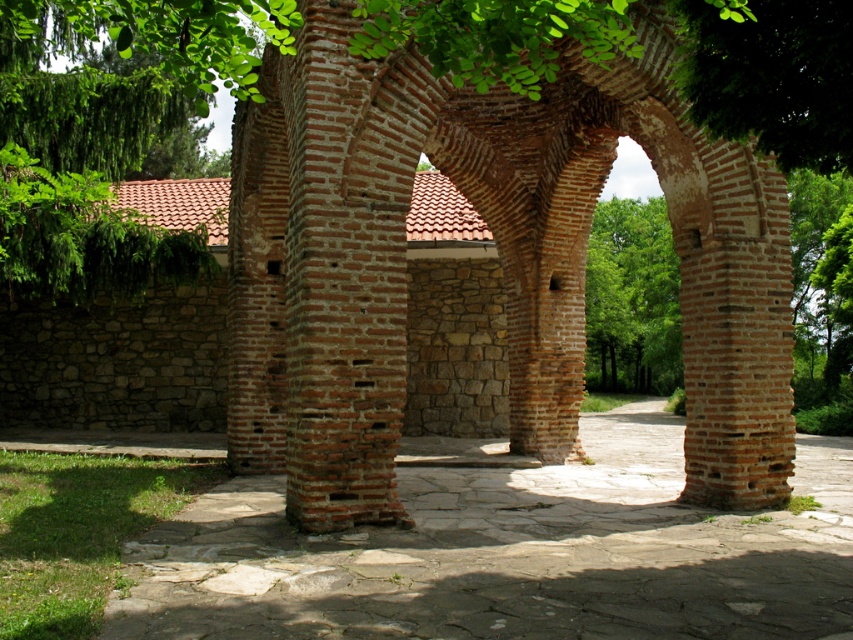
You are an architect assessing the dimensions of the structures in the image. Which of the two objects, the brown brick arch at center or the brown stone courtyard at center, has a larger size?

The brown brick arch at center is bigger than the brown stone courtyard at center according to the description.